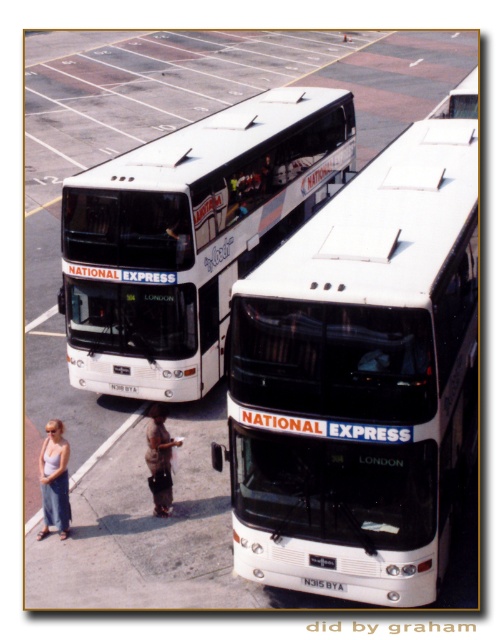
Who is more distant from viewer, (257, 376) or (199, 218)?

The point (199, 218) is more distant.

Does white matte bus at center have a lesser width compared to white matte double-decker bus at center?

Incorrect, white matte bus at center's width is not less than white matte double-decker bus at center's.

Is point (322, 472) closer to viewer compared to point (132, 177)?

Yes, point (322, 472) is in front of point (132, 177).

Where is `white matte bus at center`? The image size is (503, 640). white matte bus at center is located at coordinates (363, 376).

The width and height of the screenshot is (503, 640). Describe the element at coordinates (363, 376) in the screenshot. I see `white matte bus at center` at that location.

Based on the photo, is white matte bus at center above brown fabric shorts at center?

Yes.

Locate an element on the screen. white matte bus at center is located at coordinates (363, 376).

The height and width of the screenshot is (640, 503). I want to click on white matte bus at center, so click(x=363, y=376).

Is point (138, 284) farther from viewer compared to point (60, 536)?

Yes.

Does white matte double-decker bus at center have a greater width compared to denim skirt at lower left?

Yes, white matte double-decker bus at center is wider than denim skirt at lower left.

The height and width of the screenshot is (640, 503). Find the location of `white matte double-decker bus at center`. white matte double-decker bus at center is located at coordinates (190, 236).